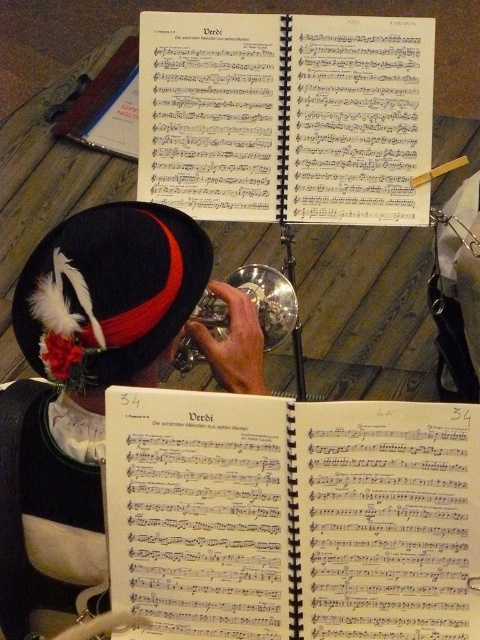
Can you confirm if velvet black hat with feather at upper left is shorter than silver metallic trumpet at center?

No.

Between point (101, 225) and point (269, 308), which one is positioned behind?

Point (269, 308)

Locate an element on the screen. The image size is (480, 640). velvet black hat with feather at upper left is located at coordinates (110, 289).

Between point (92, 509) and point (195, 349), which one is positioned behind?

Positioned behind is point (195, 349).

Can you confirm if velvet hat at center is positioned below silver metallic trumpet at center?

Indeed, velvet hat at center is positioned under silver metallic trumpet at center.

Between point (75, 305) and point (264, 340), which one is positioned in front?

Point (75, 305) is more forward.

What are the coordinates of `velvet hat at center` in the screenshot? It's located at (97, 369).

Is point (249, 310) positioned before point (60, 284)?

No, it is not.

Does velvet hat at center appear on the left side of velvet black hat with feather at upper left?

In fact, velvet hat at center is to the right of velvet black hat with feather at upper left.

Between point (50, 500) and point (151, 240), which one is positioned behind?

Point (50, 500)

Where is `velvet hat at center`? The height and width of the screenshot is (640, 480). velvet hat at center is located at coordinates (97, 369).